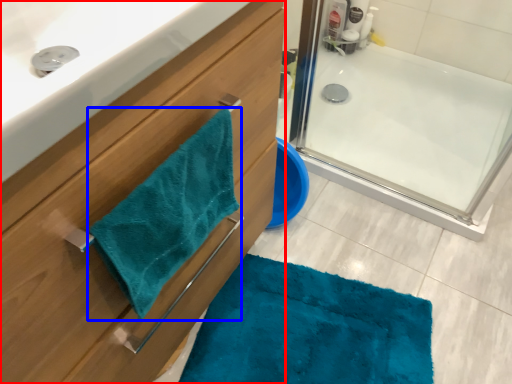
Question: Which object is closer to the camera taking this photo, bathroom cabinet (highlighted by a red box) or beach towel (highlighted by a blue box)?

Choices:
 (A) bathroom cabinet
 (B) beach towel

Answer: (A)